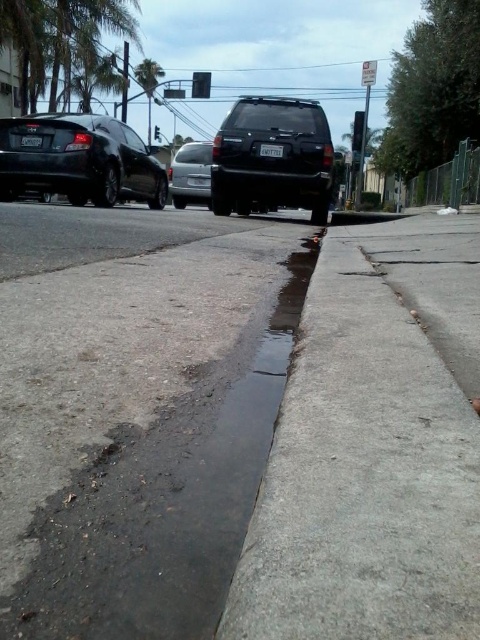
You are standing at the curb and want to take a photo of the glossy black suv at center. Where should you position yourself to capture it in the frame?

The glossy black suv at center is located at point (273, 157) in the image, so position yourself directly in front of that coordinate to capture it in the frame.

You are standing at point A which is at the position of point (363, 116). You want to walk to the black sedan closest to you. Is the point (175, 161) between you and the black sedan?

Point (175, 161) is in front of point (363, 116), so yes, the point (175, 161) is between you and the black sedan.

Based on the photo, you are standing on the sidewalk looking at the street. There is a point at coordinates [358,131]. Which object from the scene does this point belong to?

The point at coordinates [358,131] belongs to the black glass traffic light at upper center.